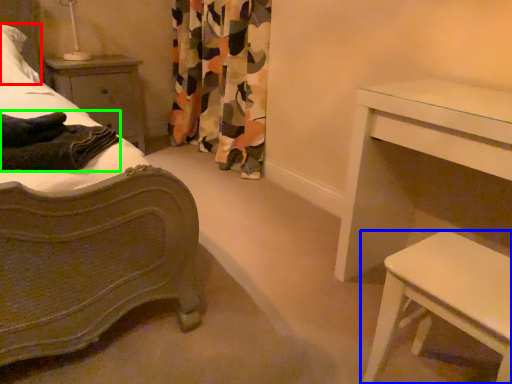
Question: Considering the real-world distances, which object is farthest from pillow (highlighted by a red box)? table (highlighted by a blue box) or blanket (highlighted by a green box)?

Choices:
 (A) table
 (B) blanket

Answer: (A)